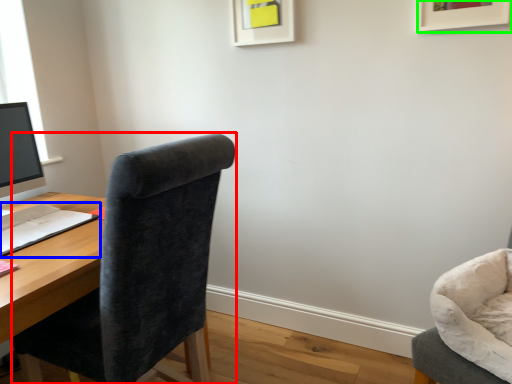
Question: Which object is positioned closest to chair (highlighted by a red box)? Select from notepad (highlighted by a blue box) and picture frame (highlighted by a green box).

Choices:
 (A) notepad
 (B) picture frame

Answer: (A)